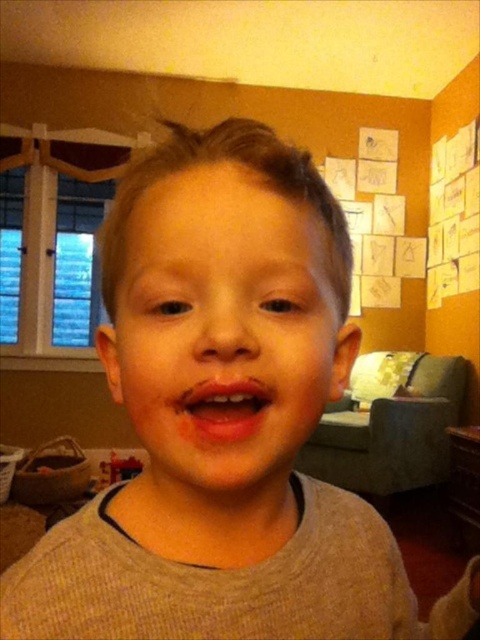
Is smooth skin face at center shorter than bright red lips at center?

No.

This screenshot has height=640, width=480. Describe the element at coordinates (224, 326) in the screenshot. I see `smooth skin face at center` at that location.

Is point (320, 392) behind point (207, 416)?

Yes, it is.

You are a GUI agent. You are given a task and a screenshot of the screen. Output one action in this format:
    pyautogui.click(x=<x>, y=<y>)
    Task: Click on the smooth skin face at center
    
    Given the screenshot: What is the action you would take?
    pyautogui.click(x=224, y=326)